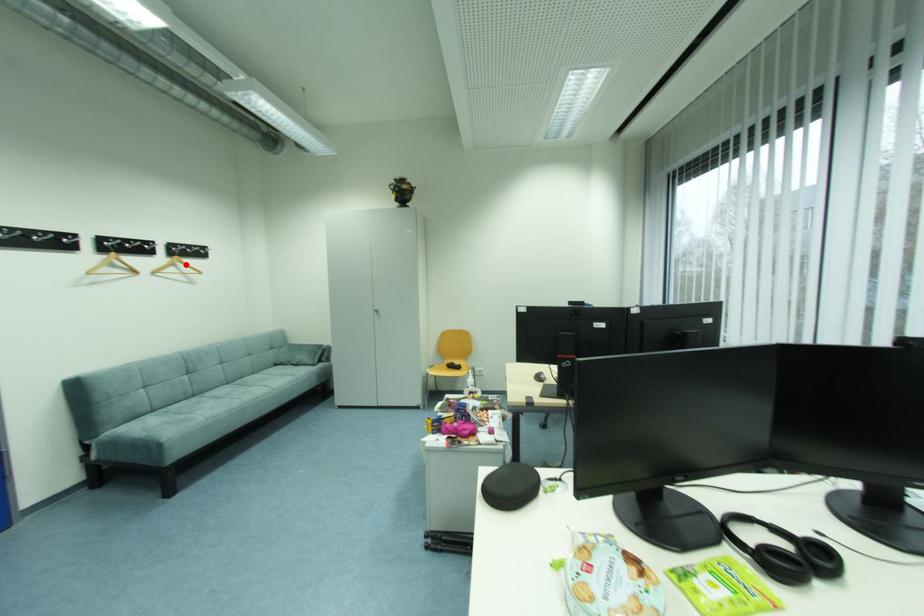
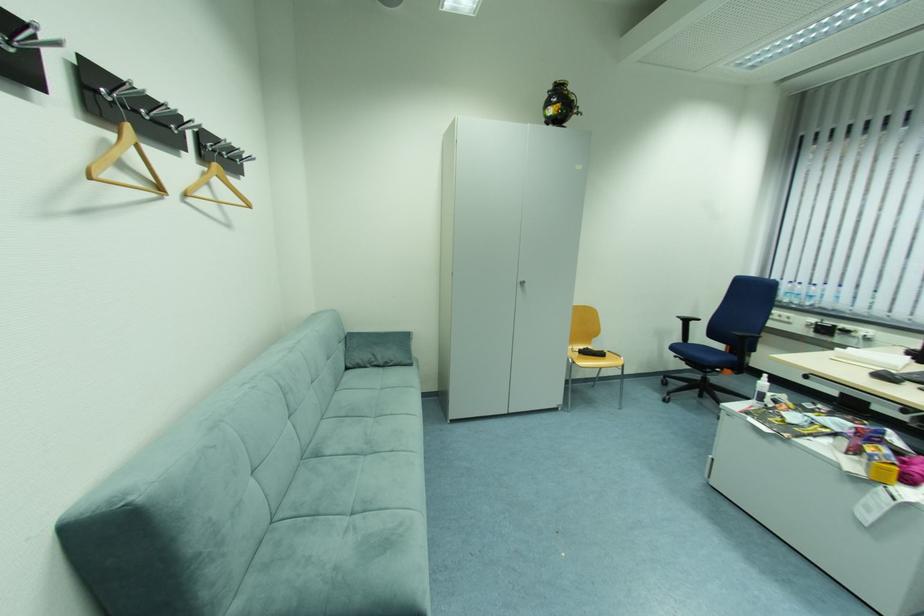
Where in the second image is the point corresponding to the highlighted location from the first image?

(223, 182)